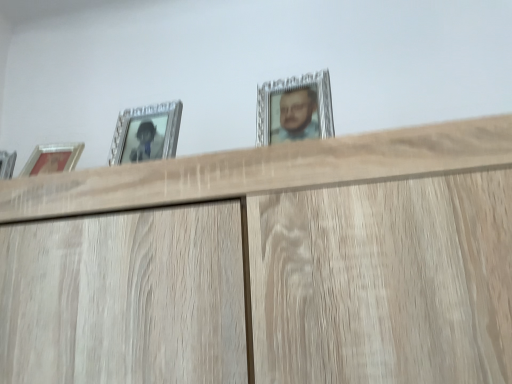
The image size is (512, 384). Describe the element at coordinates (294, 109) in the screenshot. I see `silver metallic picture frame at upper center, which is the first picture frame in right-to-left order` at that location.

In order to click on silver metallic picture frame at upper center, which is the first picture frame in right-to-left order in this screenshot , I will do `click(294, 109)`.

How much space does silver metallic picture frame at upper left, which is the 1th picture frame from left to right, occupy horizontally?

7.15 centimeters.

Locate an element on the screen. silver metallic picture frame at upper left, which is counted as the 2th picture frame, starting from the right is located at coordinates (146, 133).

The height and width of the screenshot is (384, 512). What do you see at coordinates (146, 133) in the screenshot? I see `silver metallic picture frame at upper left, which is the 1th picture frame from left to right` at bounding box center [146, 133].

Identify the location of silver metallic picture frame at upper center, which ranks as the 2th picture frame in left-to-right order. This screenshot has height=384, width=512. (294, 109).

Looking at this image, considering the relative positions of silver metallic picture frame at upper center, which is the first picture frame in right-to-left order, and silver metallic picture frame at upper left, which is the 1th picture frame from left to right, in the image provided, is silver metallic picture frame at upper center, which is the first picture frame in right-to-left order, to the left of silver metallic picture frame at upper left, which is the 1th picture frame from left to right, from the viewer's perspective?

Incorrect, silver metallic picture frame at upper center, which is the first picture frame in right-to-left order, is not on the left side of silver metallic picture frame at upper left, which is the 1th picture frame from left to right.

Relative to silver metallic picture frame at upper left, which is counted as the 2th picture frame, starting from the right, is silver metallic picture frame at upper center, which is the first picture frame in right-to-left order, in front or behind?

Visually, silver metallic picture frame at upper center, which is the first picture frame in right-to-left order, is located in front of silver metallic picture frame at upper left, which is counted as the 2th picture frame, starting from the right.

Which is farther, [296,89] or [153,110]?

The point [153,110] is farther.

From the image's perspective, is silver metallic picture frame at upper center, which ranks as the 2th picture frame in left-to-right order, over silver metallic picture frame at upper left, which is counted as the 2th picture frame, starting from the right?

Yes, from the image's perspective, silver metallic picture frame at upper center, which ranks as the 2th picture frame in left-to-right order, is above silver metallic picture frame at upper left, which is counted as the 2th picture frame, starting from the right.

Looking at this image, from a real-world perspective, does silver metallic picture frame at upper center, which is the first picture frame in right-to-left order, stand above silver metallic picture frame at upper left, which is counted as the 2th picture frame, starting from the right?

Correct, in the physical world, silver metallic picture frame at upper center, which is the first picture frame in right-to-left order, is higher than silver metallic picture frame at upper left, which is counted as the 2th picture frame, starting from the right.

Consider the image. Does silver metallic picture frame at upper center, which is the first picture frame in right-to-left order, have a greater width compared to silver metallic picture frame at upper left, which is the 1th picture frame from left to right?

Correct, the width of silver metallic picture frame at upper center, which is the first picture frame in right-to-left order, exceeds that of silver metallic picture frame at upper left, which is the 1th picture frame from left to right.

Considering the sizes of objects silver metallic picture frame at upper center, which is the first picture frame in right-to-left order, and silver metallic picture frame at upper left, which is the 1th picture frame from left to right, in the image provided, who is taller, silver metallic picture frame at upper center, which is the first picture frame in right-to-left order, or silver metallic picture frame at upper left, which is the 1th picture frame from left to right,?

With more height is silver metallic picture frame at upper left, which is the 1th picture frame from left to right.

Is silver metallic picture frame at upper center, which is the first picture frame in right-to-left order, smaller than silver metallic picture frame at upper left, which is counted as the 2th picture frame, starting from the right?

No.

Would you say silver metallic picture frame at upper center, which is the first picture frame in right-to-left order, contains silver metallic picture frame at upper left, which is counted as the 2th picture frame, starting from the right?

That's incorrect, silver metallic picture frame at upper left, which is counted as the 2th picture frame, starting from the right, is not inside silver metallic picture frame at upper center, which is the first picture frame in right-to-left order.

Is silver metallic picture frame at upper center, which ranks as the 2th picture frame in left-to-right order, not near silver metallic picture frame at upper left, which is counted as the 2th picture frame, starting from the right?

No, silver metallic picture frame at upper center, which ranks as the 2th picture frame in left-to-right order, is not far from silver metallic picture frame at upper left, which is counted as the 2th picture frame, starting from the right.

Is silver metallic picture frame at upper center, which is the first picture frame in right-to-left order, positioned with its back to silver metallic picture frame at upper left, which is the 1th picture frame from left to right?

No, silver metallic picture frame at upper center, which is the first picture frame in right-to-left order, is not facing away from silver metallic picture frame at upper left, which is the 1th picture frame from left to right.

Identify the location of picture frame that is below the silver metallic picture frame at upper center, which is the first picture frame in right-to-left order (from the image's perspective). The image size is (512, 384). (146, 133).

Is silver metallic picture frame at upper left, which is counted as the 2th picture frame, starting from the right, to the left of silver metallic picture frame at upper center, which ranks as the 2th picture frame in left-to-right order, from the viewer's perspective?

Yes.

Considering their positions, is silver metallic picture frame at upper left, which is counted as the 2th picture frame, starting from the right, located in front of or behind silver metallic picture frame at upper center, which is the first picture frame in right-to-left order?

Visually, silver metallic picture frame at upper left, which is counted as the 2th picture frame, starting from the right, is located behind silver metallic picture frame at upper center, which is the first picture frame in right-to-left order.

Does point (153, 146) come in front of point (261, 112)?

That is False.

From the image's perspective, relative to silver metallic picture frame at upper center, which ranks as the 2th picture frame in left-to-right order, is silver metallic picture frame at upper left, which is counted as the 2th picture frame, starting from the right, above or below?

From the image's perspective, silver metallic picture frame at upper left, which is counted as the 2th picture frame, starting from the right, appears below silver metallic picture frame at upper center, which ranks as the 2th picture frame in left-to-right order.

From a real-world perspective, who is located higher, silver metallic picture frame at upper left, which is counted as the 2th picture frame, starting from the right, or silver metallic picture frame at upper center, which is the first picture frame in right-to-left order?

silver metallic picture frame at upper center, which is the first picture frame in right-to-left order, from a real-world perspective.

Is silver metallic picture frame at upper left, which is the 1th picture frame from left to right, wider than silver metallic picture frame at upper center, which is the first picture frame in right-to-left order?

In fact, silver metallic picture frame at upper left, which is the 1th picture frame from left to right, might be narrower than silver metallic picture frame at upper center, which is the first picture frame in right-to-left order.

Can you confirm if silver metallic picture frame at upper left, which is counted as the 2th picture frame, starting from the right, is taller than silver metallic picture frame at upper center, which is the first picture frame in right-to-left order?

Correct, silver metallic picture frame at upper left, which is counted as the 2th picture frame, starting from the right, is much taller as silver metallic picture frame at upper center, which is the first picture frame in right-to-left order.

Is silver metallic picture frame at upper left, which is counted as the 2th picture frame, starting from the right, smaller than silver metallic picture frame at upper center, which ranks as the 2th picture frame in left-to-right order?

Yes.

Consider the image. Would you say silver metallic picture frame at upper left, which is the 1th picture frame from left to right, contains silver metallic picture frame at upper center, which ranks as the 2th picture frame in left-to-right order?

No, silver metallic picture frame at upper center, which ranks as the 2th picture frame in left-to-right order, is not inside silver metallic picture frame at upper left, which is the 1th picture frame from left to right.

Is silver metallic picture frame at upper left, which is counted as the 2th picture frame, starting from the right, in contact with silver metallic picture frame at upper center, which is the first picture frame in right-to-left order?

No, silver metallic picture frame at upper left, which is counted as the 2th picture frame, starting from the right, is not making contact with silver metallic picture frame at upper center, which is the first picture frame in right-to-left order.

Is silver metallic picture frame at upper left, which is the 1th picture frame from left to right, positioned with its back to silver metallic picture frame at upper center, which ranks as the 2th picture frame in left-to-right order?

silver metallic picture frame at upper left, which is the 1th picture frame from left to right, does not have its back to silver metallic picture frame at upper center, which ranks as the 2th picture frame in left-to-right order.

How different are the orientations of silver metallic picture frame at upper left, which is the 1th picture frame from left to right, and silver metallic picture frame at upper center, which ranks as the 2th picture frame in left-to-right order, in degrees?

The angular difference between silver metallic picture frame at upper left, which is the 1th picture frame from left to right, and silver metallic picture frame at upper center, which ranks as the 2th picture frame in left-to-right order, is 0.972 degrees.

At what (x,y) coordinates should I click in order to perform the action: click on picture frame that is on the left side of silver metallic picture frame at upper center, which ranks as the 2th picture frame in left-to-right order. Please return your answer as a coordinate pair (x, y). Looking at the image, I should click on (146, 133).

This screenshot has height=384, width=512. Find the location of `picture frame below the silver metallic picture frame at upper center, which is the first picture frame in right-to-left order (from the image's perspective)`. picture frame below the silver metallic picture frame at upper center, which is the first picture frame in right-to-left order (from the image's perspective) is located at coordinates (146, 133).

At what (x,y) coordinates should I click in order to perform the action: click on picture frame in front of the silver metallic picture frame at upper left, which is the 1th picture frame from left to right. Please return your answer as a coordinate pair (x, y). The image size is (512, 384). Looking at the image, I should click on (294, 109).